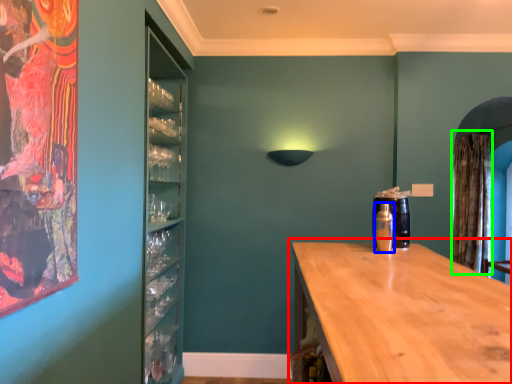
Question: Which is nearer to the countertop (highlighted by a red box)? bottle (highlighted by a blue box) or curtain (highlighted by a green box).

Choices:
 (A) bottle
 (B) curtain

Answer: (A)